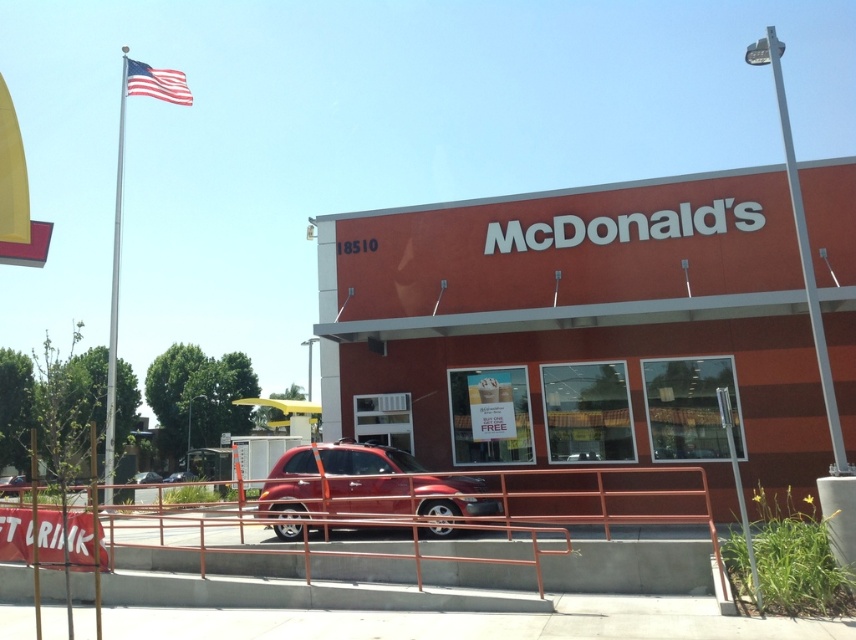
You are a delivery driver approaching the McDonald restaurant entrance. You see two metallic red suv at lower center and metallic red suv at center. Which one is closer to the entrance?

The metallic red suv at lower center is closer to the entrance than the metallic red suv at center.

You are standing at the entrance of the McDonalds restaurant and want to take a photo of the matte red car at lower center. Where should you position yourself to capture the car in the frame?

The matte red car at lower center is located at point (578,328), so you should position yourself near the entrance facing towards the lower center area to include the car in your photo.